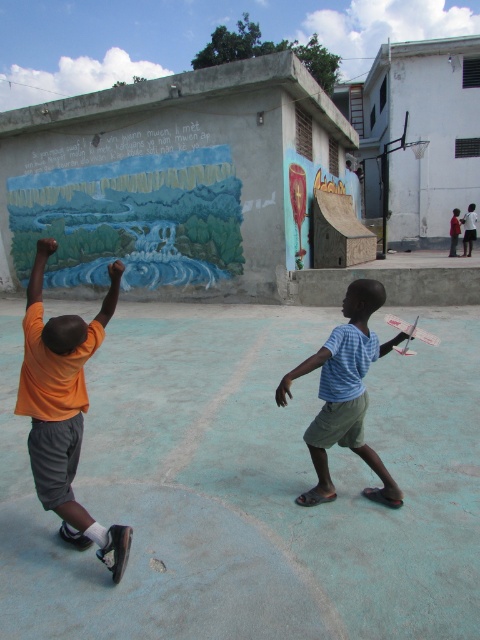
Question: Which object appears closest to the camera in this image?

Choices:
 (A) orange matte shirt at upper left
 (B) blue striped shirt at center

Answer: (A)

Question: Does orange matte shirt at upper left have a lesser width compared to blue striped shirt at center?

Choices:
 (A) no
 (B) yes

Answer: (B)

Question: Observing the image, what is the correct spatial positioning of orange matte shirt at upper left in reference to blue striped shirt at center?

Choices:
 (A) below
 (B) above

Answer: (B)

Question: Is orange matte shirt at upper left above blue striped shirt at center?

Choices:
 (A) no
 (B) yes

Answer: (B)